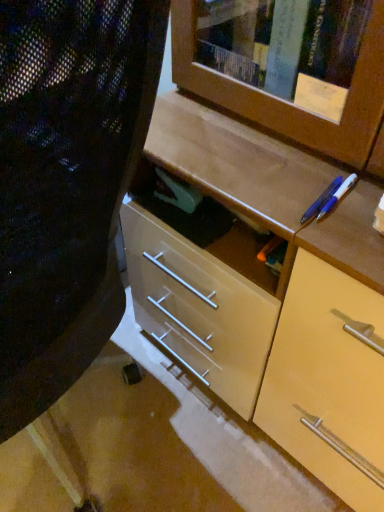
Question: From their relative heights in the image, would you say matte black folding chair at center is taller or shorter than blue plastic pen at upper right, the first pencil in the right-to-left sequence?

Choices:
 (A) tall
 (B) short

Answer: (A)

Question: From the image's perspective, relative to blue plastic pen at upper right, the first pencil in the right-to-left sequence, is matte black folding chair at center above or below?

Choices:
 (A) above
 (B) below

Answer: (B)

Question: Estimate the real-world distances between objects in this image. Which object is farther from the matte black folding chair at center?

Choices:
 (A) blue glossy pen at upper right, placed as the 1th pencil when sorted from left to right
 (B) blue plastic pen at upper right, which is the 2th pencil in left-to-right order

Answer: (B)

Question: Which object is positioned closest to the matte black folding chair at center?

Choices:
 (A) blue plastic pen at upper right, which is the 2th pencil in left-to-right order
 (B) blue glossy pen at upper right, which is the second pencil from right to left

Answer: (B)